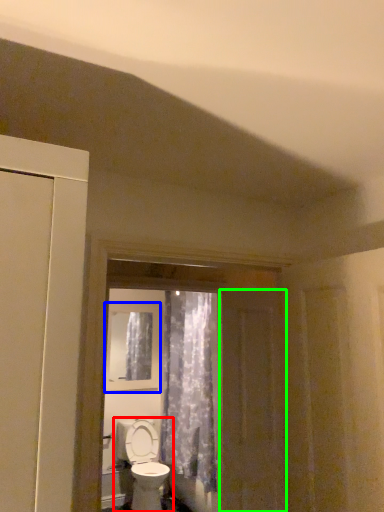
Question: Which is farther away from toilet (highlighted by a red box)? window (highlighted by a blue box) or screen door (highlighted by a green box)?

Choices:
 (A) window
 (B) screen door

Answer: (B)